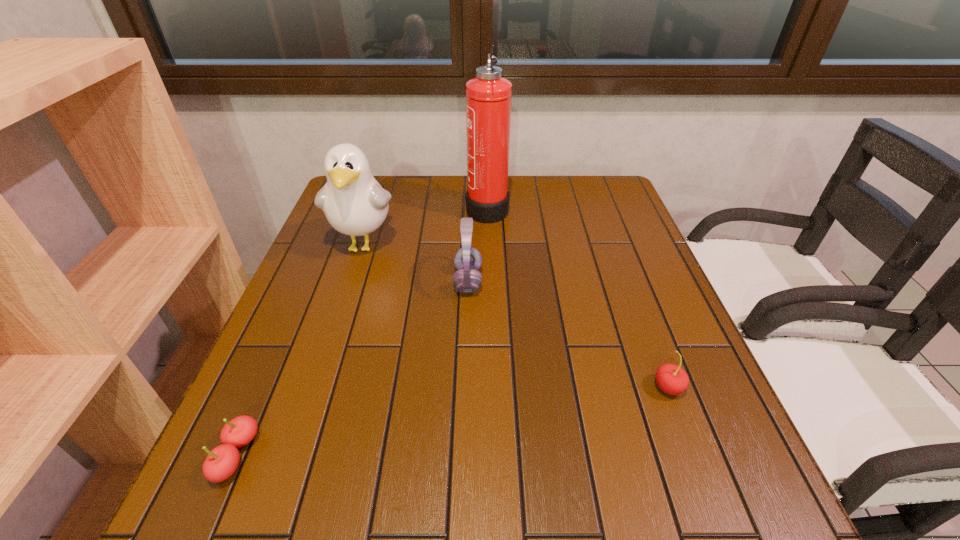
Image resolution: width=960 pixels, height=540 pixels. I want to click on free space that satisfies the following two spatial constraints: 1. on the back side of the nearer cherry; 2. on the right side of the fourth farthest object, so click(267, 387).

Find the location of a particular element. The height and width of the screenshot is (540, 960). vacant space that satisfies the following two spatial constraints: 1. on the back side of the second nearest object; 2. on the front-facing side of the fire extinguisher is located at coordinates (600, 207).

Identify the location of free location that satisfies the following two spatial constraints: 1. on the front-facing side of the tallest object; 2. on the beak of the fourth shortest object. [488, 245].